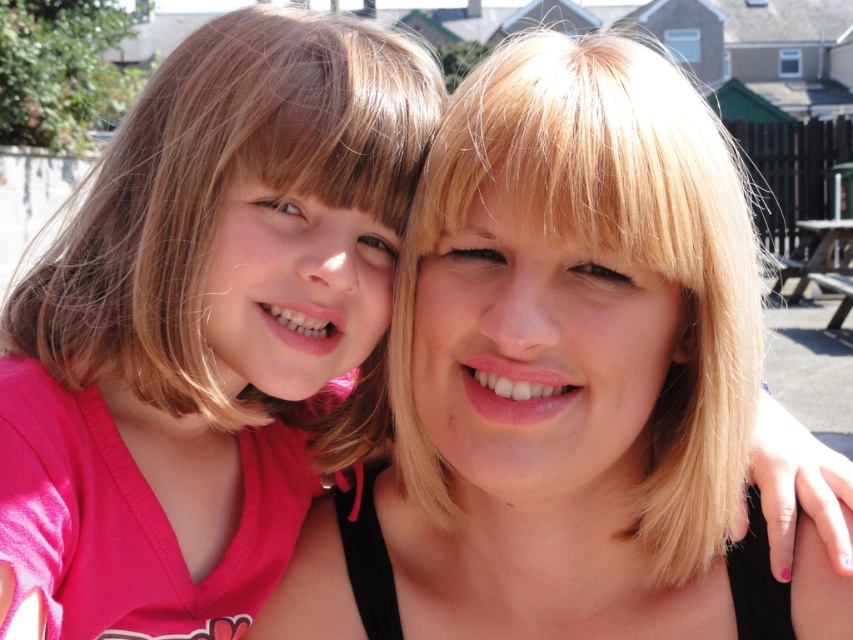
Question: Is blonde hair at center thinner than matte pink shirt at left?

Choices:
 (A) yes
 (B) no

Answer: (B)

Question: Does blonde hair at center have a greater width compared to matte pink shirt at left?

Choices:
 (A) no
 (B) yes

Answer: (B)

Question: Which point is farther to the camera?

Choices:
 (A) blonde hair at center
 (B) matte pink shirt at left

Answer: (A)

Question: Can you confirm if blonde hair at center is positioned to the right of matte pink shirt at left?

Choices:
 (A) no
 (B) yes

Answer: (B)

Question: Which of the following is the farthest from the observer?

Choices:
 (A) (320, 164)
 (B) (621, 544)

Answer: (B)